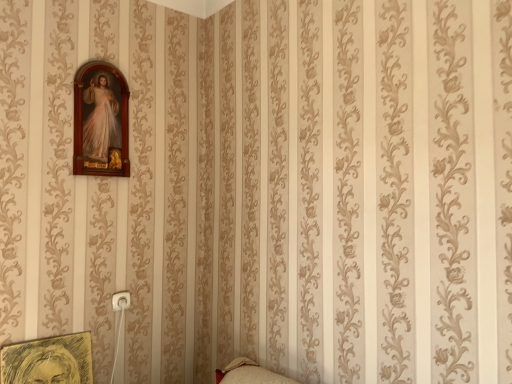
Question: From their relative heights in the image, would you say yellow sketchbook at lower left, which is the second picture frame from top to bottom, is taller or shorter than wooden picture frame at upper left, which is the first picture frame in top-to-bottom order?

Choices:
 (A) short
 (B) tall

Answer: (A)

Question: Considering the positions of yellow sketchbook at lower left, marked as the first picture frame in a bottom-to-top arrangement, and wooden picture frame at upper left, which is the first picture frame in top-to-bottom order, in the image, is yellow sketchbook at lower left, marked as the first picture frame in a bottom-to-top arrangement, wider or thinner than wooden picture frame at upper left, which is the first picture frame in top-to-bottom order,?

Choices:
 (A) wide
 (B) thin

Answer: (A)

Question: Visually, is yellow sketchbook at lower left, marked as the first picture frame in a bottom-to-top arrangement, positioned to the left or to the right of wooden picture frame at upper left, which is counted as the 2th picture frame, starting from the bottom?

Choices:
 (A) left
 (B) right

Answer: (A)

Question: In terms of size, does wooden picture frame at upper left, which is counted as the 2th picture frame, starting from the bottom, appear bigger or smaller than yellow sketchbook at lower left, marked as the first picture frame in a bottom-to-top arrangement?

Choices:
 (A) big
 (B) small

Answer: (A)

Question: Looking at their shapes, would you say wooden picture frame at upper left, which is counted as the 2th picture frame, starting from the bottom, is wider or thinner than yellow sketchbook at lower left, which is the second picture frame from top to bottom?

Choices:
 (A) thin
 (B) wide

Answer: (A)

Question: Is wooden picture frame at upper left, which is the first picture frame in top-to-bottom order, situated inside yellow sketchbook at lower left, which is the second picture frame from top to bottom, or outside?

Choices:
 (A) outside
 (B) inside

Answer: (A)

Question: From their relative heights in the image, would you say wooden picture frame at upper left, which is the first picture frame in top-to-bottom order, is taller or shorter than yellow sketchbook at lower left, marked as the first picture frame in a bottom-to-top arrangement?

Choices:
 (A) short
 (B) tall

Answer: (B)